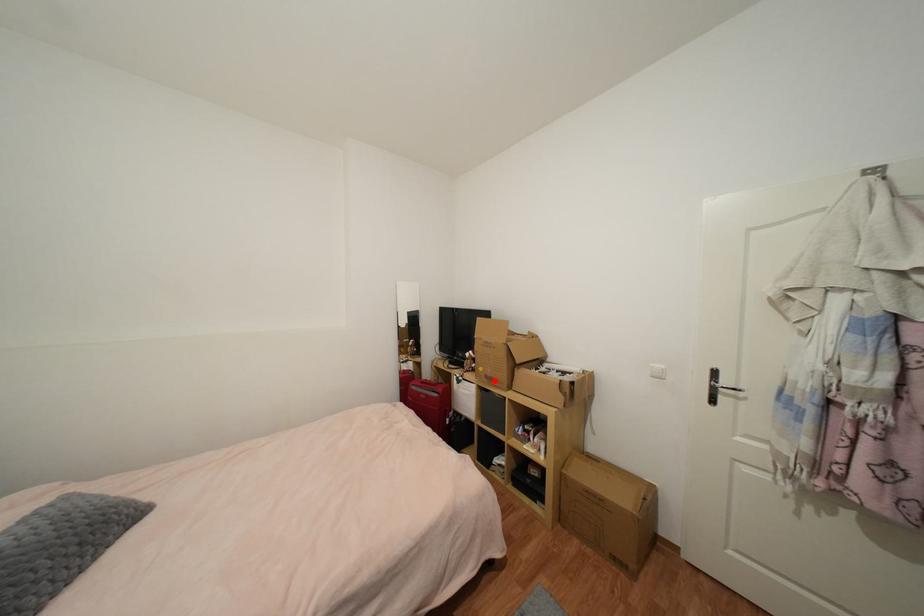
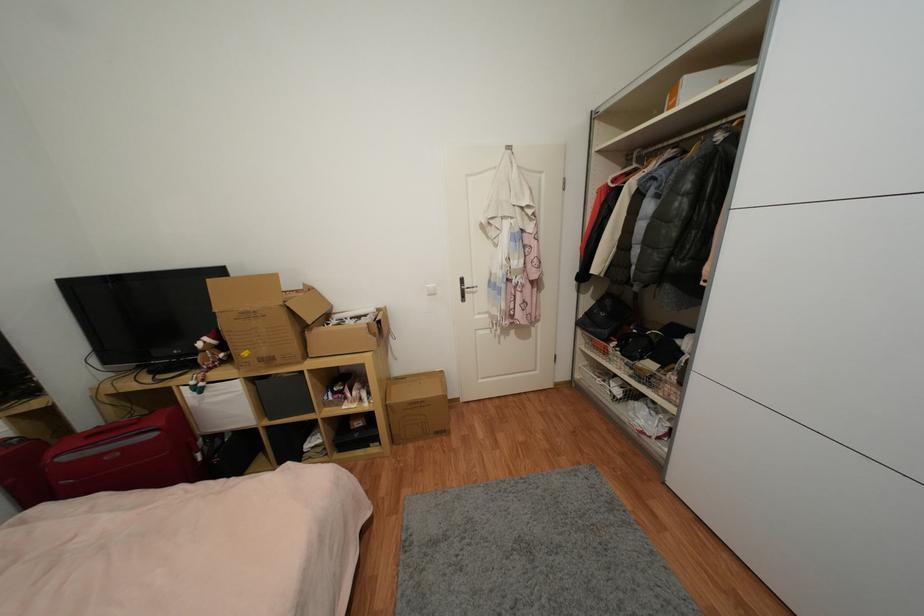
In the second image, find the point that corresponds to the highlighted location in the first image.

(274, 361)